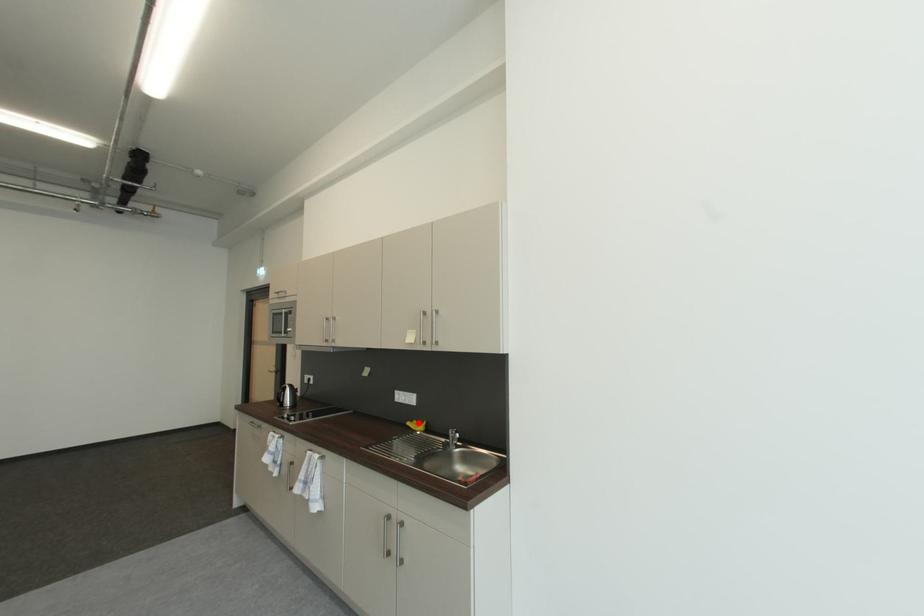
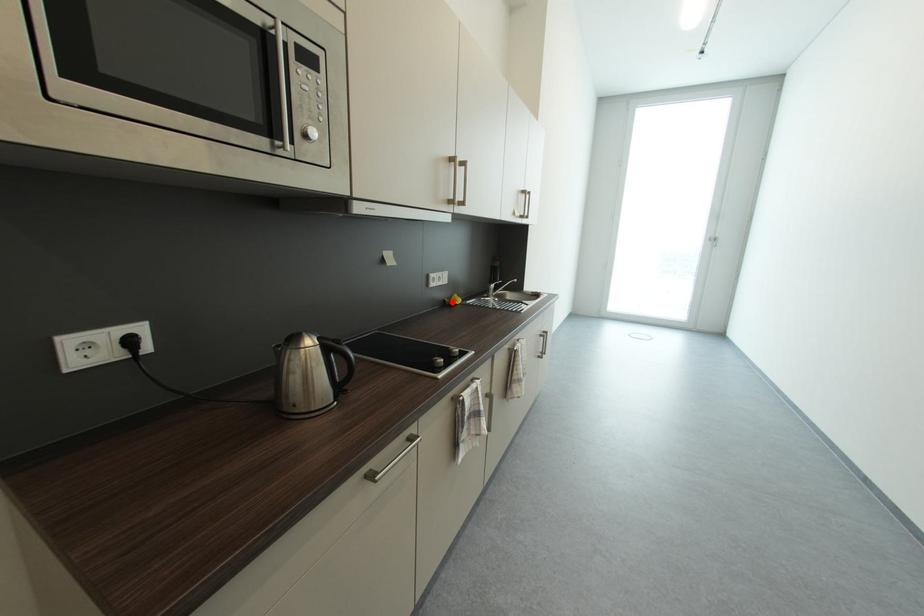
I am providing you with two images of the same scene from different viewpoints. A red point is marked on the first image and another point is marked on the second image. Does the point marked in image1 correspond to the same location as the one in image2?

Yes